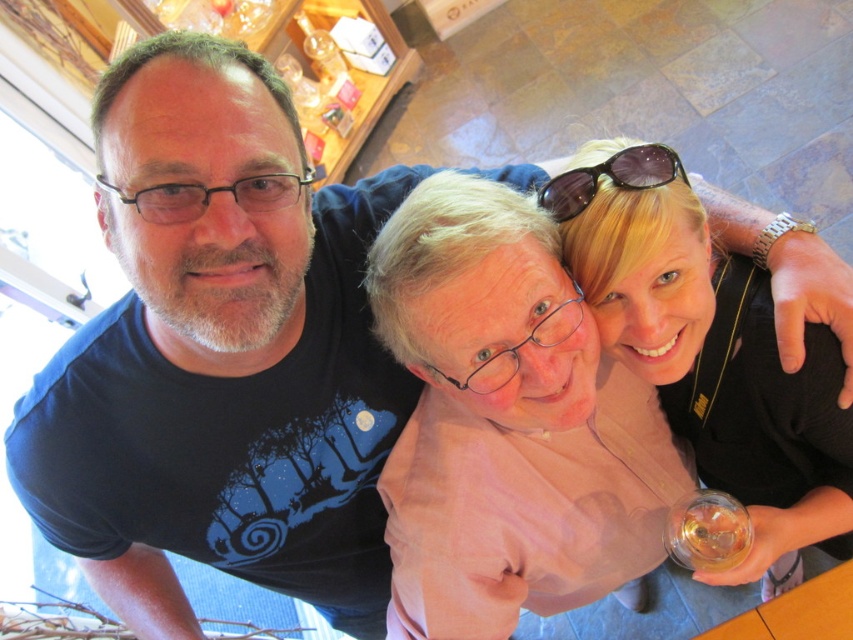
In the scene shown: You are a photographer trying to capture a clear shot of the blonde hair at upper right and the black plastic sunglasses at upper center. Since you want to focus on both objects equally, which one might require more zoom adjustment due to its size?

The blonde hair at upper right has a larger size compared to the black plastic sunglasses at upper center, so you might need to zoom out slightly to ensure both are in focus and balanced in the frame.

You are at a party and need to choose between the black plastic glasses at upper left and the black plastic sunglasses at upper center to place on a small shelf. Which one would you choose to ensure it fits?

The black plastic sunglasses at upper center should be chosen because they are smaller than the black plastic glasses at upper left, making them more likely to fit on the small shelf.